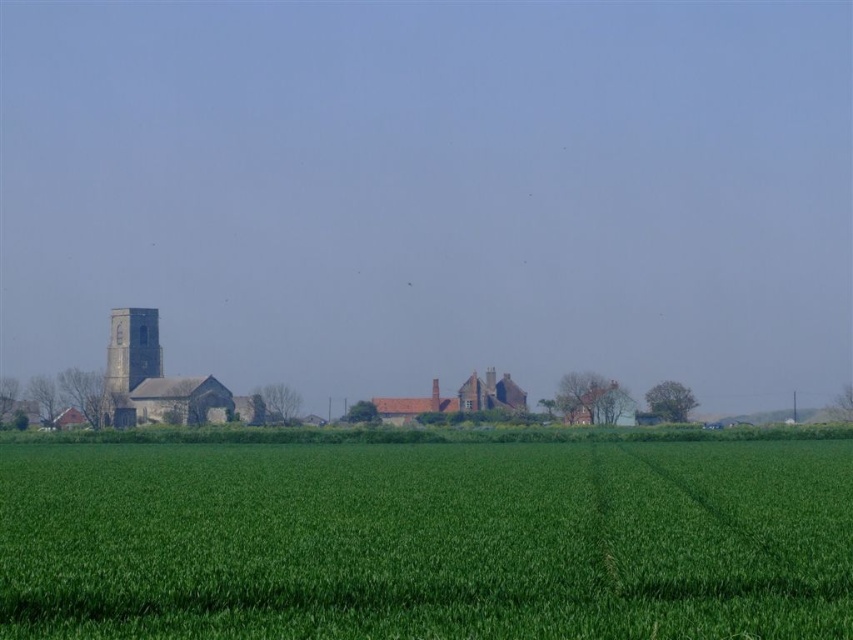
Can you confirm if green grass at center is bigger than dark gray stone tower at left?

Indeed, green grass at center has a larger size compared to dark gray stone tower at left.

Between green grass at center and dark gray stone tower at left, which one appears on the left side from the viewer's perspective?

dark gray stone tower at left is more to the left.

Is point (293, 520) positioned in front of point (125, 387)?

Yes, it is.

I want to click on green grass at center, so click(x=426, y=541).